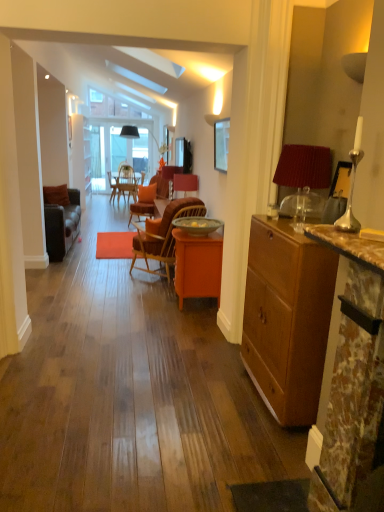
Question: Is woven wood chair at center, arranged as the second chair when viewed from the back, oriented towards red fabric lampshade at right?

Choices:
 (A) no
 (B) yes

Answer: (A)

Question: Does woven wood chair at center, the first chair positioned from the front, come in front of red fabric lampshade at right?

Choices:
 (A) no
 (B) yes

Answer: (A)

Question: Does woven wood chair at center, which is counted as the first chair, starting from the bottom, have a lesser height compared to red fabric lampshade at right?

Choices:
 (A) yes
 (B) no

Answer: (B)

Question: From a real-world perspective, does woven wood chair at center, which appears as the second chair when viewed from the top, sit lower than red fabric lampshade at right?

Choices:
 (A) yes
 (B) no

Answer: (A)

Question: Could red fabric lampshade at right be considered to be inside woven wood chair at center, which appears as the second chair when viewed from the top?

Choices:
 (A) yes
 (B) no

Answer: (B)

Question: Is velvet orange chair at center, which is counted as the first chair, starting from the back, taller or shorter than woven wood chair at center, the first chair positioned from the front?

Choices:
 (A) tall
 (B) short

Answer: (B)

Question: Is point (193, 181) positioned closer to the camera than point (167, 248)?

Choices:
 (A) farther
 (B) closer

Answer: (A)

Question: Would you say velvet orange chair at center, which is counted as the first chair, starting from the back, is inside or outside woven wood chair at center, which appears as the second chair when viewed from the top?

Choices:
 (A) inside
 (B) outside

Answer: (B)

Question: Looking at their shapes, would you say velvet orange chair at center, marked as the 1th chair in a top-to-bottom arrangement, is wider or thinner than woven wood chair at center, arranged as the second chair when viewed from the back?

Choices:
 (A) wide
 (B) thin

Answer: (B)

Question: Looking at the image, does brown marble fireplace at right seem bigger or smaller compared to woven wood chair at center, the first chair positioned from the front?

Choices:
 (A) small
 (B) big

Answer: (A)

Question: From a real-world perspective, is brown marble fireplace at right positioned above or below woven wood chair at center, arranged as the second chair when viewed from the back?

Choices:
 (A) above
 (B) below

Answer: (A)

Question: Relative to woven wood chair at center, the first chair positioned from the front, is brown marble fireplace at right in front or behind?

Choices:
 (A) behind
 (B) front

Answer: (B)

Question: Is brown marble fireplace at right inside the boundaries of woven wood chair at center, which is counted as the first chair, starting from the bottom, or outside?

Choices:
 (A) outside
 (B) inside

Answer: (A)

Question: Is point (190, 189) closer or farther from the camera than point (175, 245)?

Choices:
 (A) closer
 (B) farther

Answer: (B)

Question: In terms of height, does velvet orange chair at center, which is counted as the first chair, starting from the back, look taller or shorter compared to orange wood desk at center?

Choices:
 (A) short
 (B) tall

Answer: (A)